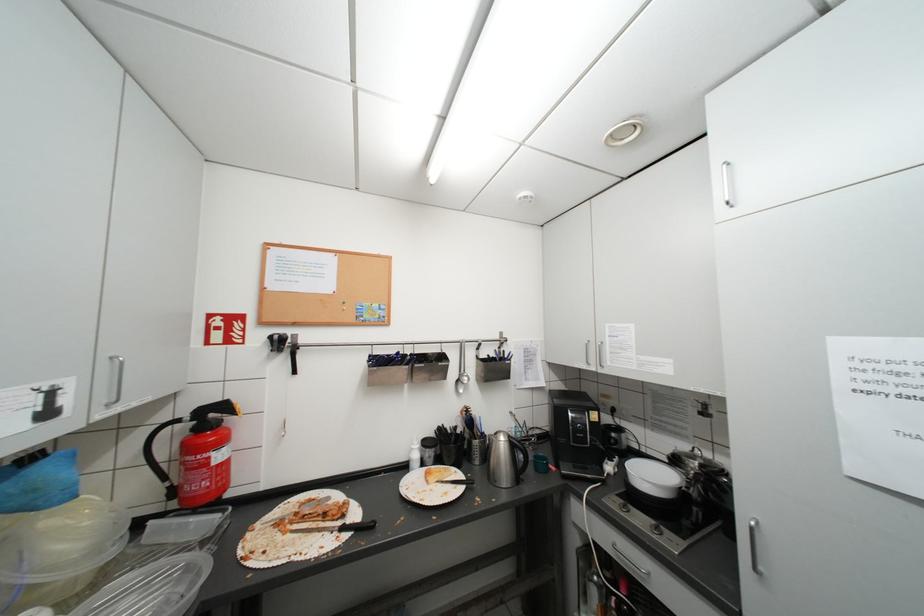
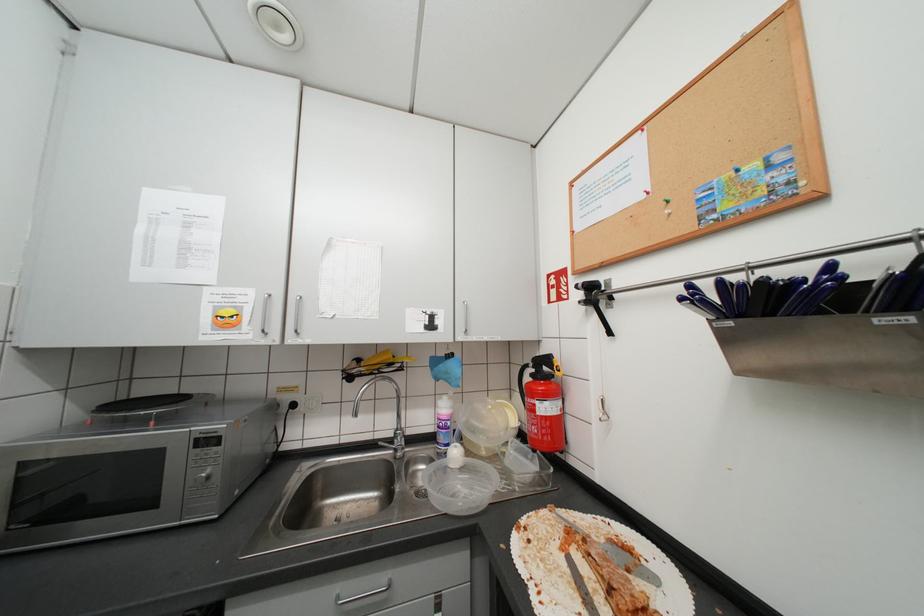
Question: The camera is either moving clockwise (left) or counter-clockwise (right) around the object. The first image is from the beginning of the video and the second image is from the end. Is the camera moving left or right when shooting the video?

Choices:
 (A) Left
 (B) Right

Answer: (B)